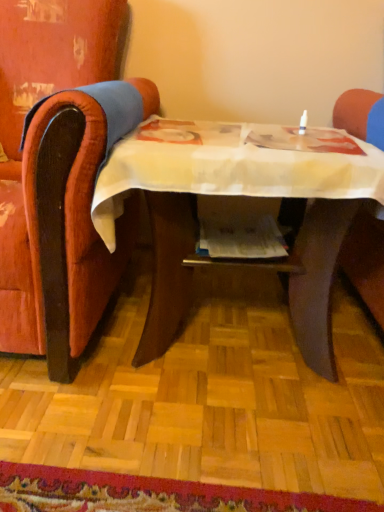
The image size is (384, 512). In order to click on free spot below wooden table at center (from a real-world perspective) in this screenshot , I will do `click(238, 337)`.